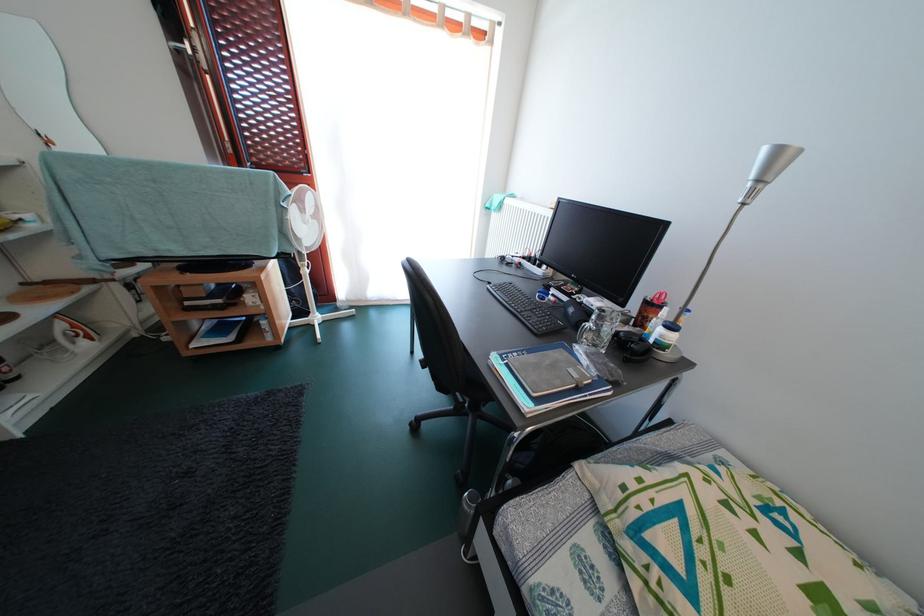
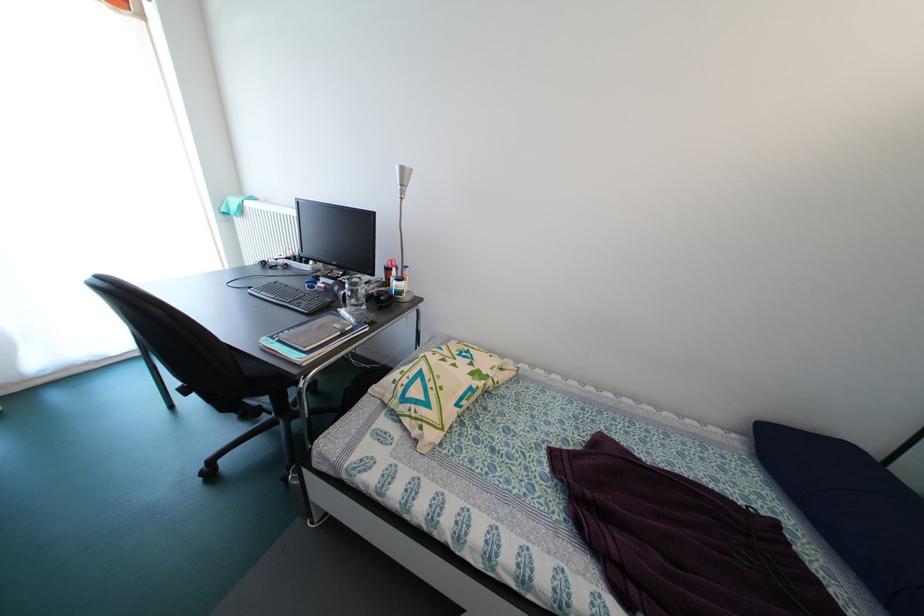
Find the pixel in the second image that matches pixel 615 334 in the first image.

(369, 297)